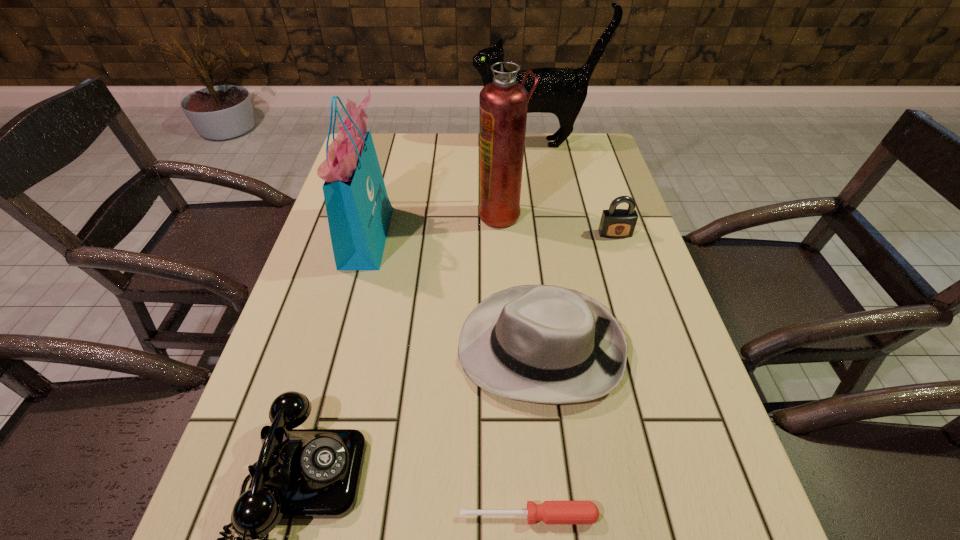
Find the location of a particular element. The height and width of the screenshot is (540, 960). free space located 0.390m on the side of the fire extinguisher with the label is located at coordinates (337, 214).

Identify the location of free location located on the side of the fire extinguisher with the label. Image resolution: width=960 pixels, height=540 pixels. (427, 214).

The height and width of the screenshot is (540, 960). I want to click on free location located on the back of the shopping bag, so click(x=389, y=157).

Find the location of `vacant region located on the front-facing side of the fedora`. vacant region located on the front-facing side of the fedora is located at coordinates (366, 347).

Where is `vacant space located on the front-facing side of the fedora`? This screenshot has height=540, width=960. vacant space located on the front-facing side of the fedora is located at coordinates (307, 347).

At what (x,y) coordinates should I click in order to perform the action: click on free space located on the front-facing side of the fedora. Please return your answer as a coordinate pair (x, y). The height and width of the screenshot is (540, 960). Looking at the image, I should click on (371, 347).

Locate an element on the screen. vacant point located 0.130m on the front of the padlock near the keyhole is located at coordinates (629, 275).

Where is `free space located on the right of the shortest object`? free space located on the right of the shortest object is located at coordinates (712, 516).

Where is `object at the far edge`? This screenshot has width=960, height=540. object at the far edge is located at coordinates (560, 91).

Locate an element on the screen. The width and height of the screenshot is (960, 540). object that is positioned at the left edge is located at coordinates (359, 212).